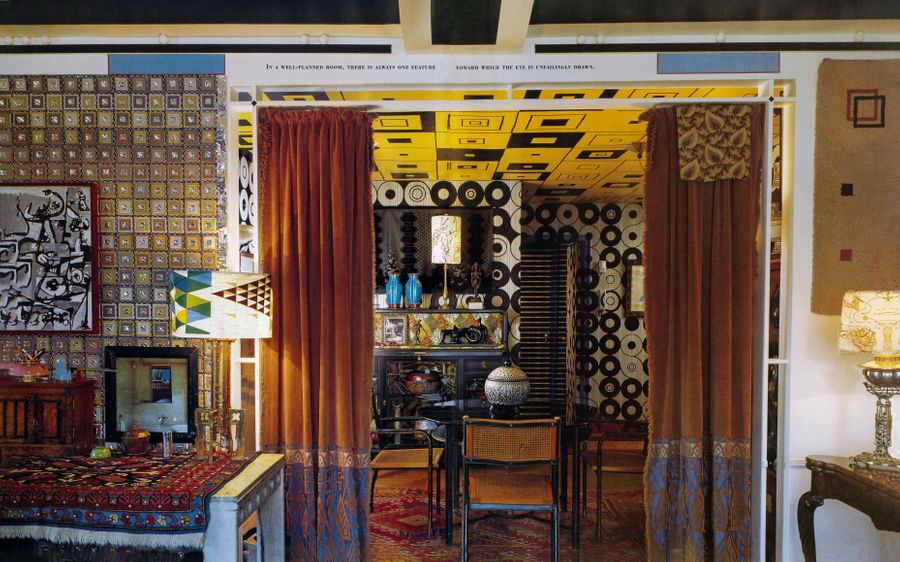
I want to click on table cloth, so click(146, 516).